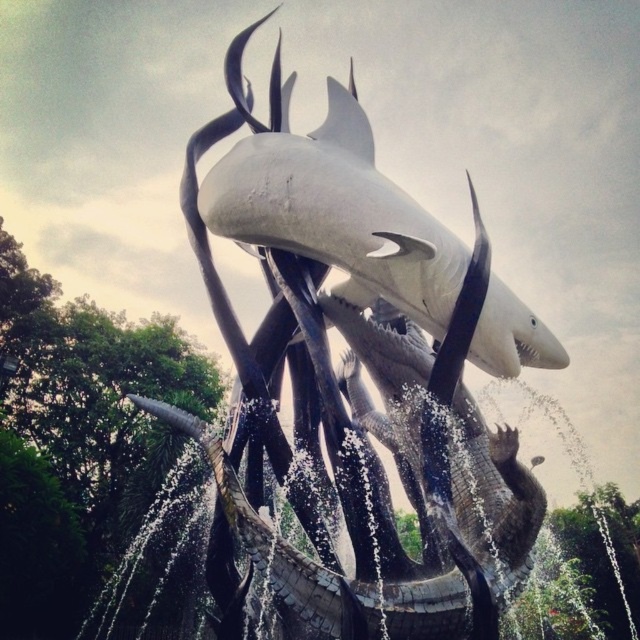
Who is positioned more to the right, white glossy shark at center or white matte shark at upper center?

From the viewer's perspective, white matte shark at upper center appears more on the right side.

Does point (384, 500) come closer to viewer compared to point (282, 129)?

Yes, point (384, 500) is closer to viewer.

Which is in front, point (266, 234) or point (328, 96)?

Point (266, 234) is in front.

At what (x,y) coordinates should I click in order to perform the action: click on white glossy shark at center. Please return your answer as a coordinate pair (x, y). The image size is (640, 640). Looking at the image, I should click on (349, 380).